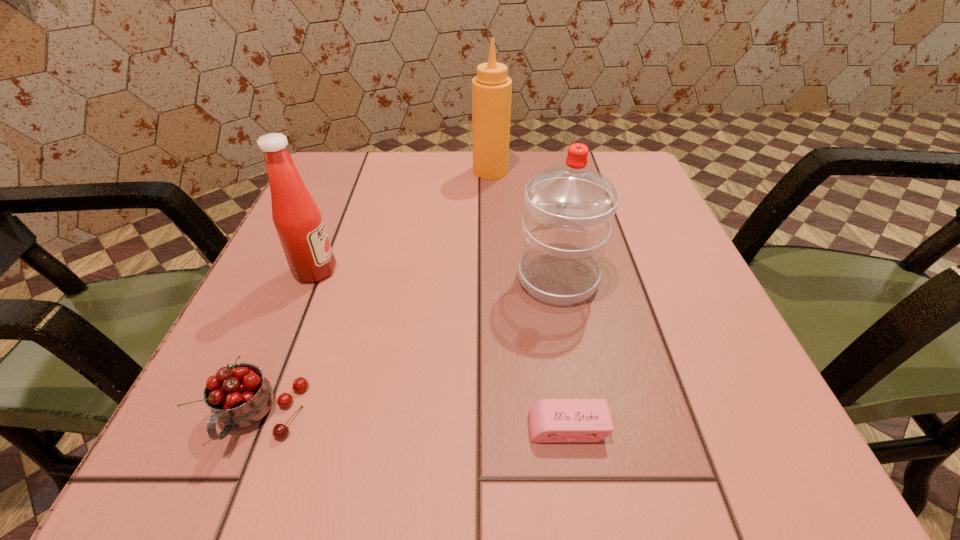
Find the location of a particular element. free point located 0.270m on the handle side of the water bottle is located at coordinates (539, 176).

Identify the location of vacant region located 0.080m on the back of the eraser. This screenshot has height=540, width=960. (557, 360).

You are a GUI agent. You are given a task and a screenshot of the screen. Output one action in this format:
    pyautogui.click(x=<x>, y=<y>)
    Task: Click on the object that is at the far edge
    This screenshot has height=540, width=960.
    Given the screenshot: What is the action you would take?
    coord(491,88)

Identify the location of cherry that is at the near edge. The image size is (960, 540). (239, 396).

Where is `eraser located at the near edge`? eraser located at the near edge is located at coordinates 550,420.

What are the coordinates of `condiment situated at the left edge` in the screenshot? It's located at (297, 219).

I want to click on cherry that is at the left edge, so click(239, 396).

Find the location of a particular element. object that is at the near left corner is located at coordinates (239, 396).

Identify the location of vacant position at the far edge of the desktop. The height and width of the screenshot is (540, 960). (563, 151).

This screenshot has height=540, width=960. In order to click on vacant region at the near edge in this screenshot , I will do `click(613, 478)`.